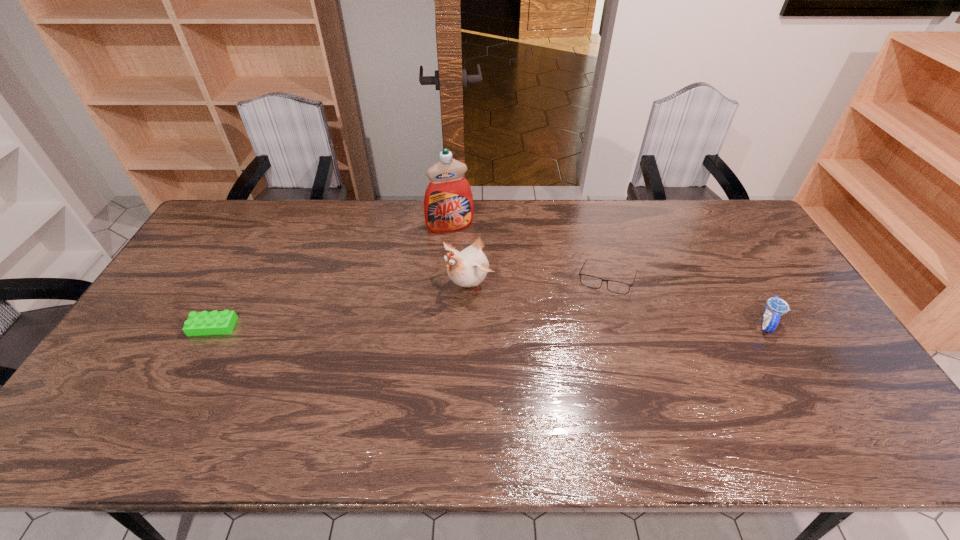
You are a GUI agent. You are given a task and a screenshot of the screen. Output one action in this format:
    pyautogui.click(x=<x>, y=<y>)
    Task: Click on the blank region between the farthest object and the fourth object from left to right
    
    Given the screenshot: What is the action you would take?
    [528, 254]

Where is `vacant space that's between the Lego and the spectacles`? This screenshot has width=960, height=540. vacant space that's between the Lego and the spectacles is located at coordinates (410, 304).

The width and height of the screenshot is (960, 540). Identify the location of free space between the spectacles and the shortest object. (410, 304).

Where is `vacant point located between the bird and the fourth object from left to right`? The height and width of the screenshot is (540, 960). vacant point located between the bird and the fourth object from left to right is located at coordinates click(x=539, y=282).

Find the location of a particular element. This screenshot has width=960, height=540. free space between the third shortest object and the leftmost object is located at coordinates (490, 325).

Where is `blank region between the tallest object and the spectacles`? blank region between the tallest object and the spectacles is located at coordinates (528, 254).

Where is `empty space between the watch and the fourth object from left to right`? The width and height of the screenshot is (960, 540). empty space between the watch and the fourth object from left to right is located at coordinates (686, 302).

Where is `free space between the fourth tallest object and the fourth shortest object`? This screenshot has height=540, width=960. free space between the fourth tallest object and the fourth shortest object is located at coordinates (539, 282).

This screenshot has width=960, height=540. What are the coordinates of `empty space that is in between the second tallest object and the watch` in the screenshot? It's located at (618, 303).

Locate which object ranks fourth in proximity to the bird. Please provide its 2D coordinates. Your answer should be formatted as a tuple, i.e. [(x, y)], where the tuple contains the x and y coordinates of a point satisfying the conditions above.

[(776, 307)]